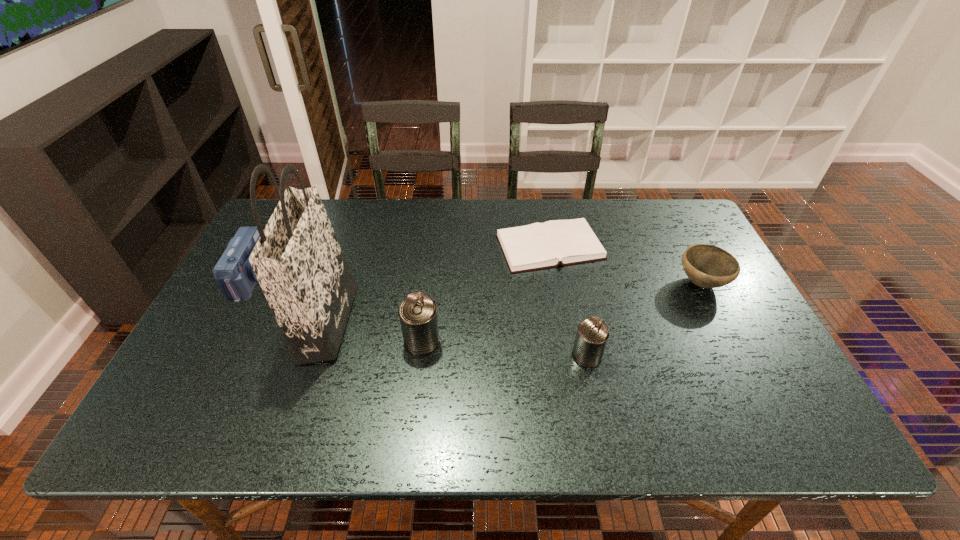
Find the location of a particular element. The height and width of the screenshot is (540, 960). free space in the image that satisfies the following two spatial constraints: 1. on the front of the shorter can with the design; 2. on the right side of the shopping bag is located at coordinates (317, 356).

At what (x,y) coordinates should I click in order to perform the action: click on free space that satisfies the following two spatial constraints: 1. on the back side of the fifth tallest object; 2. on the right side of the shorter can. Please return your answer as a coordinate pair (x, y). Image resolution: width=960 pixels, height=540 pixels. Looking at the image, I should click on (571, 283).

This screenshot has height=540, width=960. In order to click on free space that satisfies the following two spatial constraints: 1. on the lens of the camera; 2. on the left side of the rightmost object in this screenshot , I will do `click(250, 283)`.